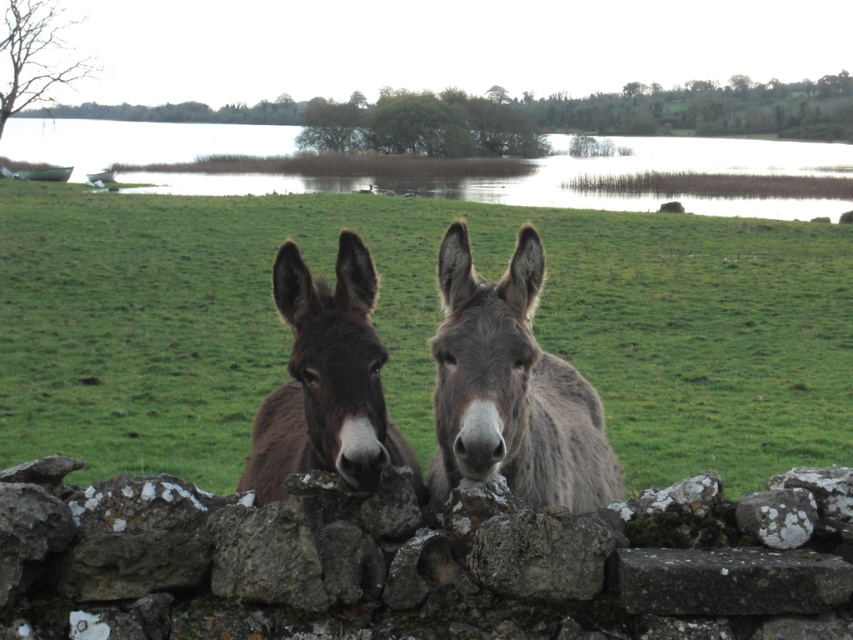
Looking at this image, you are a farmer who needs to lead both mules through a narrow path that can only accommodate one mule at a time. Since the gray fuzzy mule at center is in front of the brown fuzzy mule at center, which mule should you guide first to ensure they can pass through the path without blocking each other?

You should guide the gray fuzzy mule at center first because it is already positioned in front of the brown fuzzy mule at center. This way, the gray fuzzy mule at center can move ahead into the path first, allowing the brown fuzzy mule at center to follow without obstruction.

You are a photographer standing in front of the gray fuzzy mule at center. You want to take a closeup photo of its face. The camera you are using has a minimum focusing distance of 2 meters. Will you be able to take the photo without moving closer?

The gray fuzzy mule at center is 2.72 meters from camera. Since the minimum focusing distance is 2 meters, you can take the closeup photo without moving closer because the mule is within the camera range.